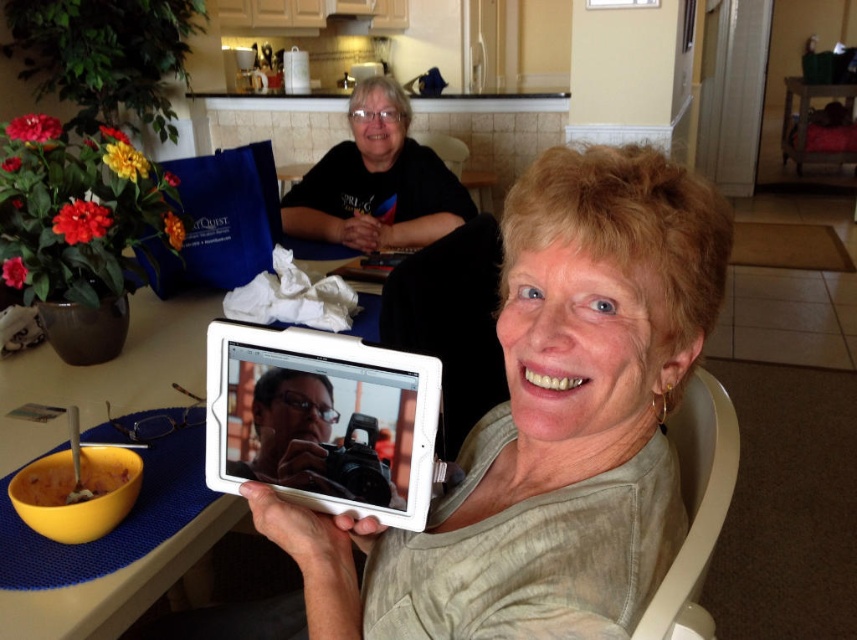
Question: Is white plastic chair at lower right smaller than orange matte bowl at lower left?

Choices:
 (A) yes
 (B) no

Answer: (B)

Question: From the image, what is the correct spatial relationship of white matte tablet computer at center in relation to yellow plastic bowl at lower left?

Choices:
 (A) right
 (B) left

Answer: (A)

Question: Does matte white tablet at center appear on the right side of orange matte bowl at lower left?

Choices:
 (A) yes
 (B) no

Answer: (A)

Question: Which of the following is the closest to the observer?

Choices:
 (A) (363, 396)
 (B) (109, 413)
 (C) (76, 490)

Answer: (A)

Question: Which of these objects is positioned closest to the yellow plastic bowl at lower left?

Choices:
 (A) orange matte bowl at lower left
 (B) white matte tablet computer at center
 (C) matte white tablet at center

Answer: (A)

Question: Which object is the closest to the white matte tablet computer at center?

Choices:
 (A) yellow plastic bowl at lower left
 (B) white plastic chair at lower right
 (C) matte white tablet at center
 (D) orange matte bowl at lower left

Answer: (C)